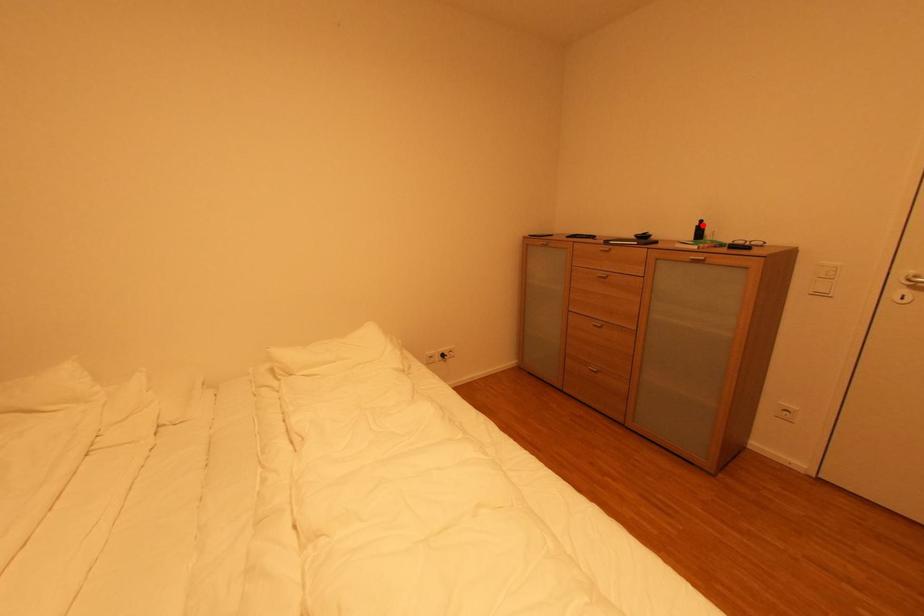
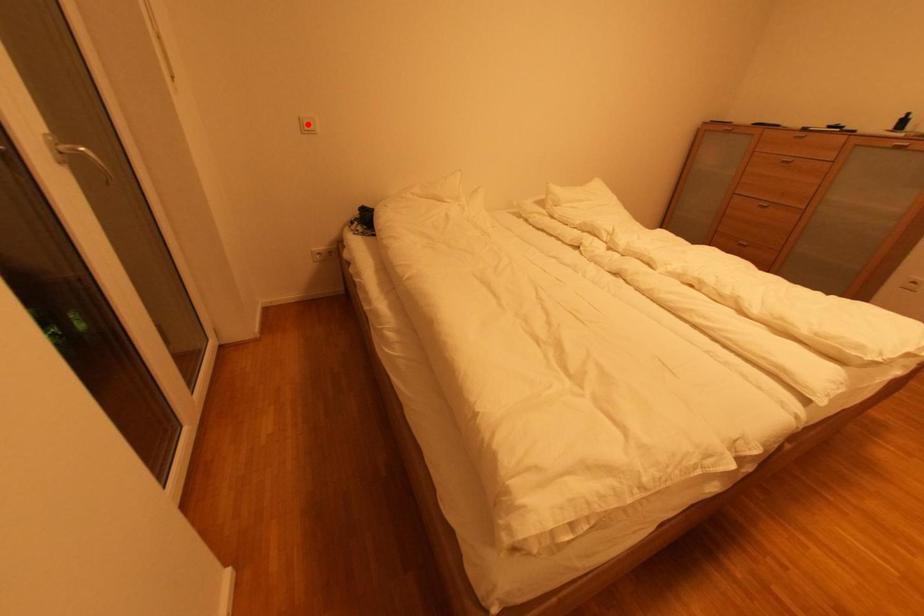
I am providing you with two images of the same scene from different viewpoints. A red point is marked on the first image and another point is marked on the second image. Does the point marked in image1 correspond to the same location as the one in image2?

No